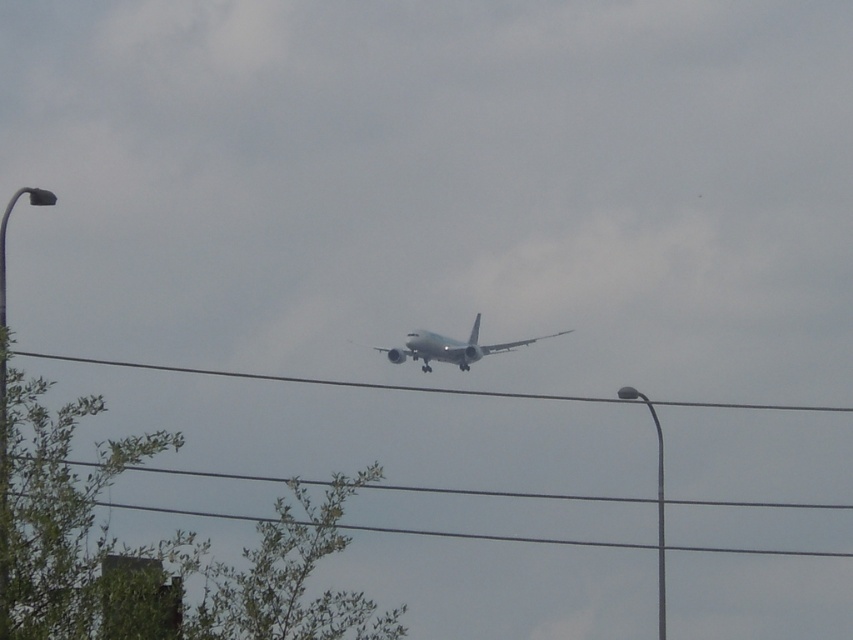
Between point (189, 566) and point (456, 362), which one is positioned in front?

Point (189, 566) is in front.

Based on the photo, is the position of green leafy tree at lower left less distant than that of white matte airplane at center?

Yes, green leafy tree at lower left is in front of white matte airplane at center.

This screenshot has width=853, height=640. I want to click on green leafy tree at lower left, so click(x=154, y=550).

Locate an element on the screen. green leafy tree at lower left is located at coordinates (154, 550).

Can you confirm if green leafy tree at lower left is positioned above black wire at center?

No.

The image size is (853, 640). What do you see at coordinates (154, 550) in the screenshot?
I see `green leafy tree at lower left` at bounding box center [154, 550].

Is point (338, 596) positioned after point (117, 364)?

No, (338, 596) is in front of (117, 364).

This screenshot has width=853, height=640. I want to click on green leafy tree at lower left, so click(x=154, y=550).

Is point (412, 390) positioned before point (451, 342)?

No, it is not.

You are a GUI agent. You are given a task and a screenshot of the screen. Output one action in this format:
    pyautogui.click(x=<x>, y=<y>)
    Task: Click on the black wire at center
    
    Given the screenshot: What is the action you would take?
    pyautogui.click(x=427, y=387)